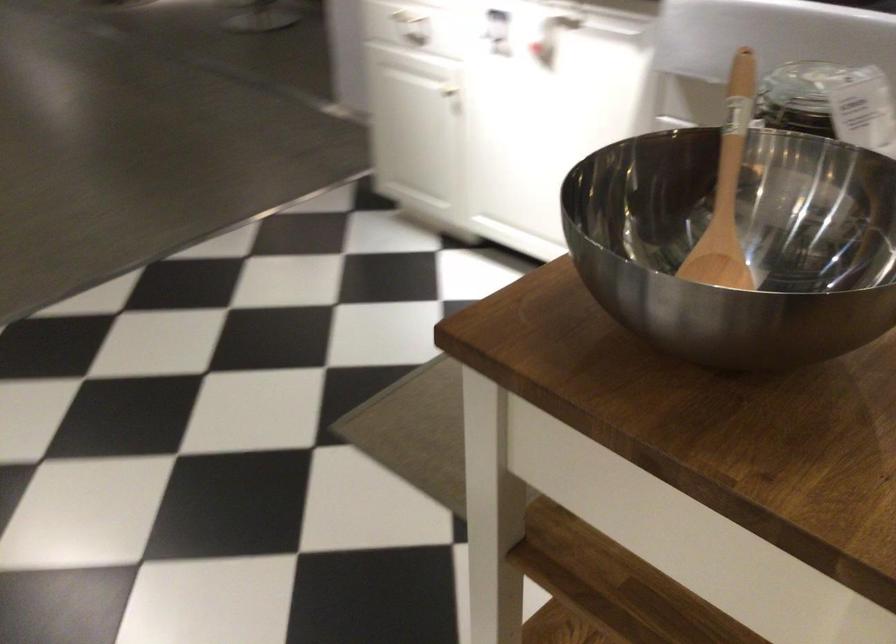
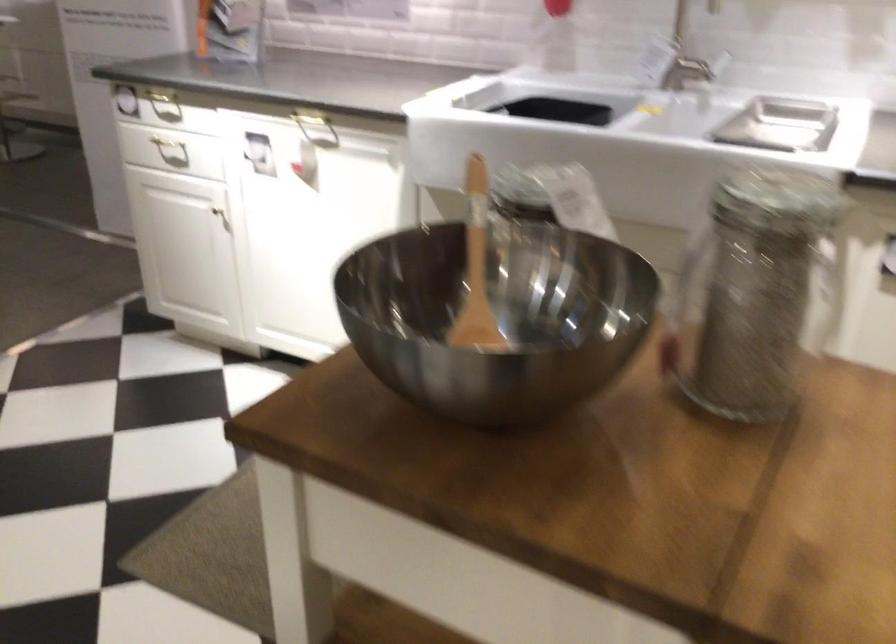
Question: How did the camera likely rotate?

Choices:
 (A) Left
 (B) Right
 (C) Up
 (D) Down

Answer: (B)